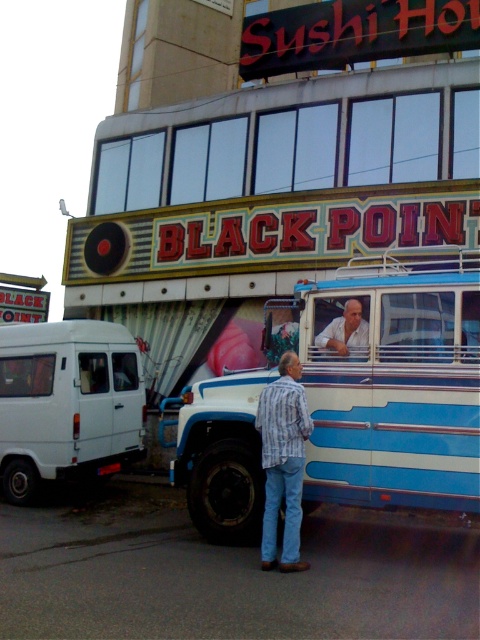
In the scene shown: You are a pedestrian standing at the front of the white matte van at left. You want to see the person wearing the white shirt at center. Can you see them without moving your position?

The white shirt at center is behind the white matte van at left, so you cannot see them from your current position.

Looking at this image, you are standing on the sidewalk in front of the vintage bus and the white matte van at left. You want to take a photo that includes both vehicles in the frame. Based on their positions, which vehicle should you position closer to the camera to ensure both are fully visible in the photo?

To include both the vintage bus and the white matte van at left in the photo, you should position the camera closer to the white matte van at left since it is farther away from the viewer, creating a balanced composition where both vehicles are within the frame.